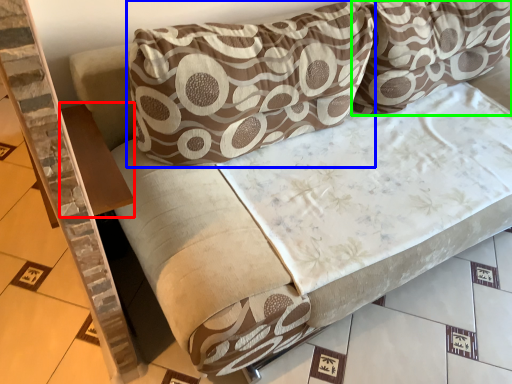
Question: Which object is the closest to the table (highlighted by a red box)? Choose among these: pillow (highlighted by a blue box) or pillow (highlighted by a green box).

Choices:
 (A) pillow
 (B) pillow

Answer: (A)